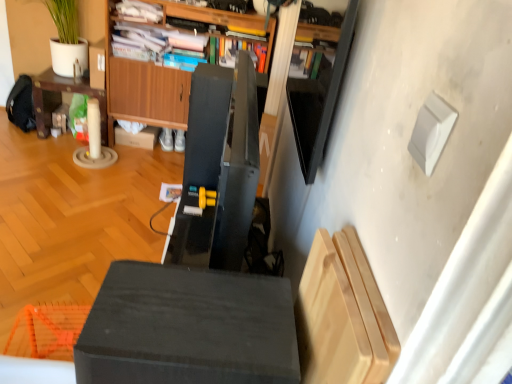
Question: From the image's perspective, does wooden cabinet at center appear lower than matte black cube at center?

Choices:
 (A) no
 (B) yes

Answer: (A)

Question: Is wooden cabinet at center bigger than matte black cube at center?

Choices:
 (A) yes
 (B) no

Answer: (A)

Question: Is wooden cabinet at center facing towards matte black cube at center?

Choices:
 (A) yes
 (B) no

Answer: (A)

Question: From a real-world perspective, is wooden cabinet at center positioned under matte black cube at center based on gravity?

Choices:
 (A) yes
 (B) no

Answer: (A)

Question: Is wooden cabinet at center behind matte black cube at center?

Choices:
 (A) yes
 (B) no

Answer: (A)

Question: In terms of width, does brown cardboard box at center look wider or thinner when compared to light wood cutting board at lower right?

Choices:
 (A) wide
 (B) thin

Answer: (A)

Question: Considering the positions of brown cardboard box at center and light wood cutting board at lower right in the image, is brown cardboard box at center taller or shorter than light wood cutting board at lower right?

Choices:
 (A) tall
 (B) short

Answer: (B)

Question: Considering the relative positions of brown cardboard box at center and light wood cutting board at lower right in the image provided, is brown cardboard box at center to the left or to the right of light wood cutting board at lower right?

Choices:
 (A) right
 (B) left

Answer: (B)

Question: Considering their positions, is brown cardboard box at center located in front of or behind light wood cutting board at lower right?

Choices:
 (A) front
 (B) behind

Answer: (B)

Question: Looking at the image, does wooden cabinet at center seem bigger or smaller compared to light wood cutting board at lower right?

Choices:
 (A) small
 (B) big

Answer: (B)

Question: Would you say wooden cabinet at center is to the left or to the right of light wood cutting board at lower right in the picture?

Choices:
 (A) left
 (B) right

Answer: (A)

Question: Considering the positions of wooden cabinet at center and light wood cutting board at lower right in the image, is wooden cabinet at center taller or shorter than light wood cutting board at lower right?

Choices:
 (A) tall
 (B) short

Answer: (A)

Question: In terms of width, does wooden cabinet at center look wider or thinner when compared to light wood cutting board at lower right?

Choices:
 (A) thin
 (B) wide

Answer: (B)

Question: From the image's perspective, relative to wooden cabinet at center, is matte black cube at center above or below?

Choices:
 (A) below
 (B) above

Answer: (A)

Question: Visually, is matte black cube at center positioned to the left or to the right of wooden cabinet at center?

Choices:
 (A) left
 (B) right

Answer: (B)